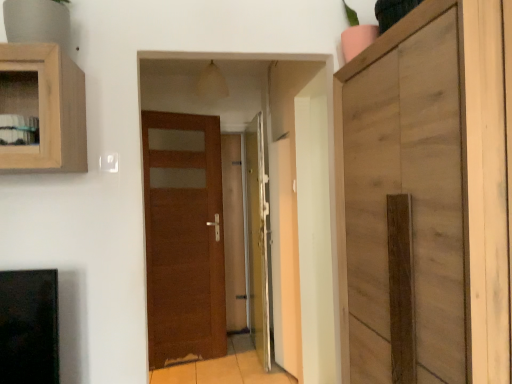
Consider the image. Measure the distance between brown wood door at center, arranged as the second door when viewed from the right, and camera.

brown wood door at center, arranged as the second door when viewed from the right, is 3.29 meters away from camera.

Find the location of `brown wood door at center, the first door when ordered from left to right`. brown wood door at center, the first door when ordered from left to right is located at coordinates (184, 236).

What do you see at coordinates (426, 193) in the screenshot?
I see `wooden cabinet at right` at bounding box center [426, 193].

Locate an element on the screen. The height and width of the screenshot is (384, 512). transparent glass door at center is located at coordinates (234, 232).

In order to face translucent glass door at center, which is the second door in left-to-right order, should I rotate leftwards or rightwards?

Rotate left and turn 0.239 degrees.

The image size is (512, 384). I want to click on translucent glass door at center, the first door from the right, so click(x=258, y=239).

This screenshot has height=384, width=512. In order to click on brown wood door at center, arranged as the second door when viewed from the right in this screenshot , I will do `click(184, 236)`.

From the picture: Which of these two, translucent glass door at center, the first door from the right, or brown wood door at center, the first door when ordered from left to right, is wider?

translucent glass door at center, the first door from the right.

Can you see translucent glass door at center, the first door from the right, touching brown wood door at center, arranged as the second door when viewed from the right?

There is a gap between translucent glass door at center, the first door from the right, and brown wood door at center, arranged as the second door when viewed from the right.

Between translucent glass door at center, the first door from the right, and brown wood door at center, the first door when ordered from left to right, which one has larger size?

With larger size is translucent glass door at center, the first door from the right.

Locate an element on the screen. glass door that is below the wooden cabinet at right (from the image's perspective) is located at coordinates (234, 232).

Between wooden cabinet at right and transparent glass door at center, which one has smaller width?

transparent glass door at center is thinner.

What's the angular difference between wooden cabinet at right and transparent glass door at center's facing directions?

89.4 degrees.

Would you consider wooden cabinet at right to be distant from transparent glass door at center?

wooden cabinet at right is far away from transparent glass door at center.

Which is less distant, (242,178) or (494,326)?

Clearly, point (242,178) is more distant from the camera than point (494,326).

Considering the relative sizes of transparent glass door at center and wooden cabinet at right in the image provided, is transparent glass door at center wider than wooden cabinet at right?

No.

From a real-world perspective, is transparent glass door at center physically located above or below wooden cabinet at right?

transparent glass door at center is below wooden cabinet at right.

Could you tell me if wooden cabinet at right is turned towards brown wood door at center, the first door when ordered from left to right?

No.

Considering the relative sizes of wooden cabinet at right and brown wood door at center, the first door when ordered from left to right, in the image provided, is wooden cabinet at right shorter than brown wood door at center, the first door when ordered from left to right,?

Correct, wooden cabinet at right is not as tall as brown wood door at center, the first door when ordered from left to right.

Is point (344, 116) closer to viewer compared to point (162, 261)?

Yes, it is.

Which of these two, wooden cabinet at right or brown wood door at center, the first door when ordered from left to right, is smaller?

brown wood door at center, the first door when ordered from left to right.

Considering their positions, is translucent glass door at center, the first door from the right, located in front of or behind wooden cabinet at right?

Clearly, translucent glass door at center, the first door from the right, is behind wooden cabinet at right.

Is point (256, 197) positioned before point (462, 276)?

No, it is not.

From the image's perspective, who appears lower, translucent glass door at center, the first door from the right, or wooden cabinet at right?

From the image's view, translucent glass door at center, the first door from the right, is below.

You are a GUI agent. You are given a task and a screenshot of the screen. Output one action in this format:
    pyautogui.click(x=<x>, y=<y>)
    Task: Click on the cupboard in front of the translucent glass door at center, the first door from the right
    
    Given the screenshot: What is the action you would take?
    pyautogui.click(x=426, y=193)

Could you tell me if brown wood door at center, arranged as the second door when viewed from the right, is turned towards wooden cabinet at right?

Yes, brown wood door at center, arranged as the second door when viewed from the right, is oriented towards wooden cabinet at right.

From the image's perspective, does brown wood door at center, the first door when ordered from left to right, appear lower than wooden cabinet at right?

Yes, from the image's perspective, brown wood door at center, the first door when ordered from left to right, is beneath wooden cabinet at right.

Considering the positions of points (201, 320) and (383, 330), is point (201, 320) farther from camera compared to point (383, 330)?

That is True.

Considering the relative sizes of brown wood door at center, arranged as the second door when viewed from the right, and wooden cabinet at right in the image provided, is brown wood door at center, arranged as the second door when viewed from the right, smaller than wooden cabinet at right?

Yes.

Looking at their sizes, would you say brown wood door at center, arranged as the second door when viewed from the right, is wider or thinner than translucent glass door at center, the first door from the right?

Considering their sizes, brown wood door at center, arranged as the second door when viewed from the right, looks slimmer than translucent glass door at center, the first door from the right.

Looking at this image, is brown wood door at center, arranged as the second door when viewed from the right, positioned beyond the bounds of translucent glass door at center, the first door from the right?

Yes, brown wood door at center, arranged as the second door when viewed from the right, is outside of translucent glass door at center, the first door from the right.

Considering the positions of objects brown wood door at center, arranged as the second door when viewed from the right, and translucent glass door at center, the first door from the right, in the image provided, who is in front, brown wood door at center, arranged as the second door when viewed from the right, or translucent glass door at center, the first door from the right,?

translucent glass door at center, the first door from the right.

Does brown wood door at center, the first door when ordered from left to right, have a larger size compared to translucent glass door at center, the first door from the right?

Incorrect, brown wood door at center, the first door when ordered from left to right, is not larger than translucent glass door at center, the first door from the right.

This screenshot has width=512, height=384. Find the location of `door lying on the right of brown wood door at center, arranged as the second door when viewed from the right`. door lying on the right of brown wood door at center, arranged as the second door when viewed from the right is located at coordinates [258, 239].

In order to click on glass door lying behind the wooden cabinet at right in this screenshot , I will do `click(234, 232)`.

From the image, which object appears to be nearer to translucent glass door at center, the first door from the right, wooden cabinet at right or brown wood door at center, the first door when ordered from left to right?

Among the two, brown wood door at center, the first door when ordered from left to right, is located nearer to translucent glass door at center, the first door from the right.

Looking at the image, which one is located closer to brown wood door at center, the first door when ordered from left to right, transparent glass door at center or translucent glass door at center, the first door from the right?

The object closer to brown wood door at center, the first door when ordered from left to right, is translucent glass door at center, the first door from the right.

Which object lies nearer to the anchor point transparent glass door at center, wooden cabinet at right or translucent glass door at center, the first door from the right?

Among the two, translucent glass door at center, the first door from the right, is located nearer to transparent glass door at center.

From the image, which object appears to be farther from brown wood door at center, the first door when ordered from left to right, translucent glass door at center, the first door from the right, or transparent glass door at center?

transparent glass door at center lies further to brown wood door at center, the first door when ordered from left to right, than the other object.

When comparing their distances from transparent glass door at center, does brown wood door at center, the first door when ordered from left to right, or wooden cabinet at right seem further?

Based on the image, wooden cabinet at right appears to be further to transparent glass door at center.

Based on their spatial positions, is brown wood door at center, arranged as the second door when viewed from the right, or transparent glass door at center closer to translucent glass door at center, the first door from the right?

brown wood door at center, arranged as the second door when viewed from the right, lies closer to translucent glass door at center, the first door from the right, than the other object.

Looking at this image, which object lies nearer to the anchor point brown wood door at center, the first door when ordered from left to right, wooden cabinet at right or translucent glass door at center, the first door from the right?

translucent glass door at center, the first door from the right, is positioned closer to the anchor brown wood door at center, the first door when ordered from left to right.

Based on the photo, looking at the image, which one is located further to wooden cabinet at right, brown wood door at center, arranged as the second door when viewed from the right, or transparent glass door at center?

transparent glass door at center lies further to wooden cabinet at right than the other object.

The width and height of the screenshot is (512, 384). I want to click on door between wooden cabinet at right and brown wood door at center, the first door when ordered from left to right, from front to back, so click(x=258, y=239).

Find the location of a particular element. door located between translucent glass door at center, the first door from the right, and transparent glass door at center in the depth direction is located at coordinates click(184, 236).